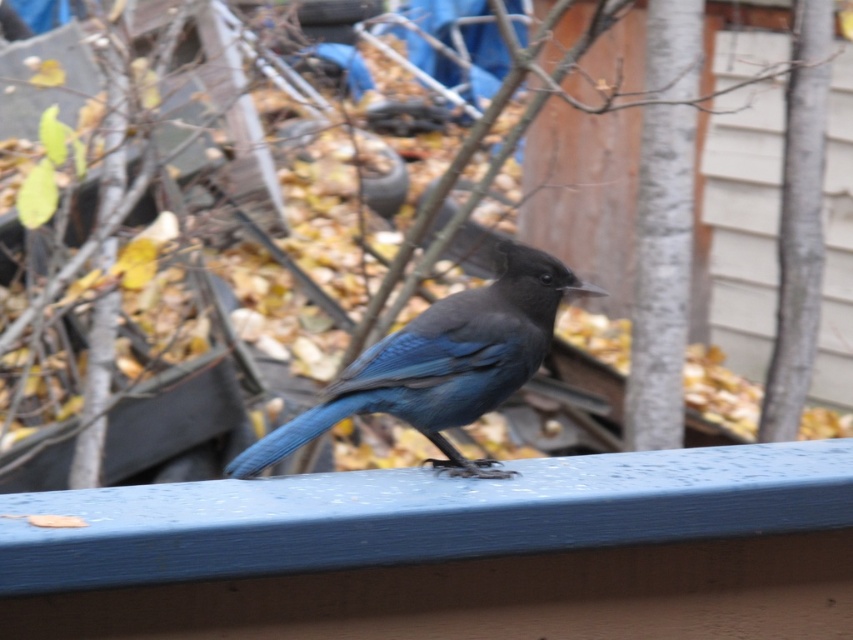
Question: Can you confirm if blue painted wood at center is positioned above satin blue bird at center?

Choices:
 (A) no
 (B) yes

Answer: (A)

Question: Which point is closer to the camera taking this photo?

Choices:
 (A) (300, 556)
 (B) (381, 403)

Answer: (A)

Question: Which point is closer to the camera?

Choices:
 (A) (430, 376)
 (B) (535, 556)

Answer: (B)

Question: Which point is closer to the camera taking this photo?

Choices:
 (A) (350, 605)
 (B) (260, 442)

Answer: (A)

Question: Can you confirm if blue painted wood at center is positioned above satin blue bird at center?

Choices:
 (A) no
 (B) yes

Answer: (A)

Question: Is the position of blue painted wood at center more distant than that of satin blue bird at center?

Choices:
 (A) yes
 (B) no

Answer: (B)